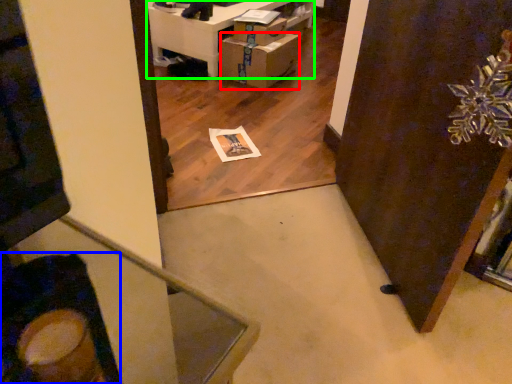
Question: Considering the real-world distances, which object is closest to cardboard box (highlighted by a red box)? swivel chair (highlighted by a blue box) or furniture (highlighted by a green box).

Choices:
 (A) swivel chair
 (B) furniture

Answer: (B)